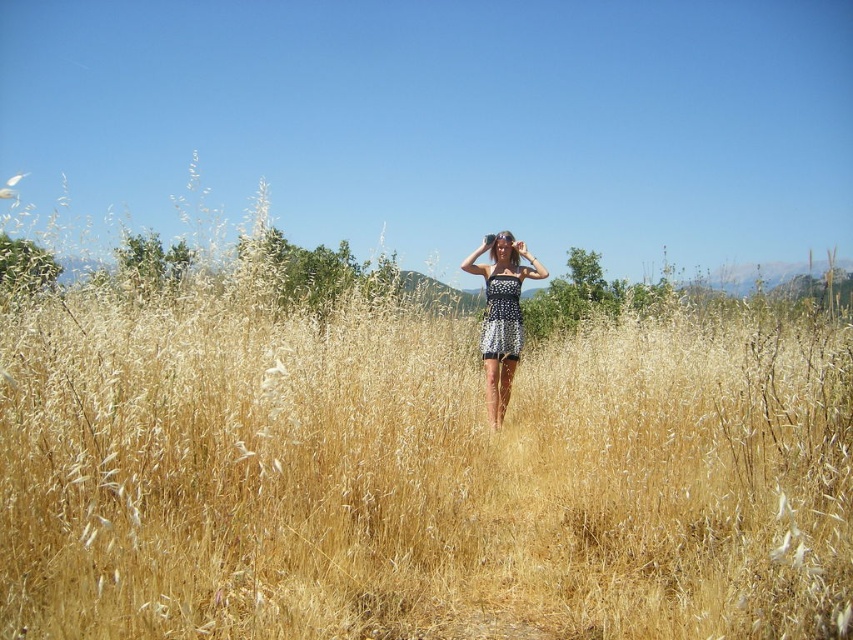
You are a photographer trying to capture both the white dotted dress at center and the black dotted dress at center in the same frame. Since you want to ensure both are in focus, which dress should you focus on first to maximize the chances of both being sharp?

You should focus on the white dotted dress at center first because it is closer to the viewer than the black dotted dress at center, so focusing on the closer object will help keep both in focus.

You are a photographer trying to capture a shot of the two dresses in the scene. The camera has a depth of field that can focus on objects within a 4 inch range. Can both the white dotted dress at center and the black dotted dress at center be in focus at the same time?

The white dotted dress at center is 4.42 inches from the black dotted dress at center. Since the depth of field can only focus within a 4 inch range, the distance between them exceeds this limit. Therefore, both cannot be in focus simultaneously.

You are standing in the field of tall grass and see two points in the scene. Which point is closer to you, point (492, 282) or point (509, 276)?

Point (492, 282) is closer to the viewer than point (509, 276).